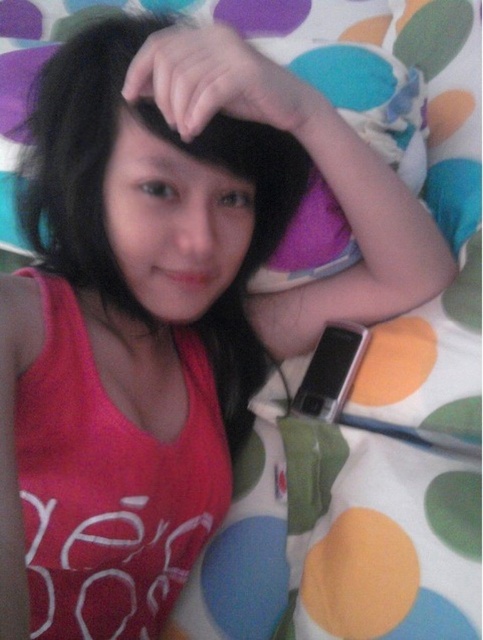
Which of these two, black matte hair at center or sleek silver phone at lower right, stands taller?

black matte hair at center

Is point (98, 115) behind point (326, 394)?

No, (98, 115) is in front of (326, 394).

Image resolution: width=483 pixels, height=640 pixels. What are the coordinates of `black matte hair at center` in the screenshot? It's located at (81, 156).